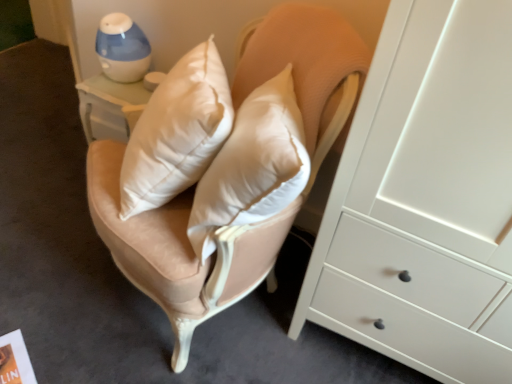
Question: Would you say blue plastic humidifier at upper left is inside or outside satin beige swivel chair at center?

Choices:
 (A) inside
 (B) outside

Answer: (B)

Question: From the image's perspective, is blue plastic humidifier at upper left positioned above or below satin beige swivel chair at center?

Choices:
 (A) above
 (B) below

Answer: (A)

Question: In terms of width, does blue plastic humidifier at upper left look wider or thinner when compared to satin beige swivel chair at center?

Choices:
 (A) thin
 (B) wide

Answer: (A)

Question: Is satin beige swivel chair at center inside or outside of blue plastic humidifier at upper left?

Choices:
 (A) inside
 (B) outside

Answer: (B)

Question: In the image, is satin beige swivel chair at center on the left side or the right side of blue plastic humidifier at upper left?

Choices:
 (A) right
 (B) left

Answer: (A)

Question: From the image's perspective, relative to blue plastic humidifier at upper left, is satin beige swivel chair at center above or below?

Choices:
 (A) above
 (B) below

Answer: (B)

Question: From their relative heights in the image, would you say satin beige swivel chair at center is taller or shorter than blue plastic humidifier at upper left?

Choices:
 (A) tall
 (B) short

Answer: (A)